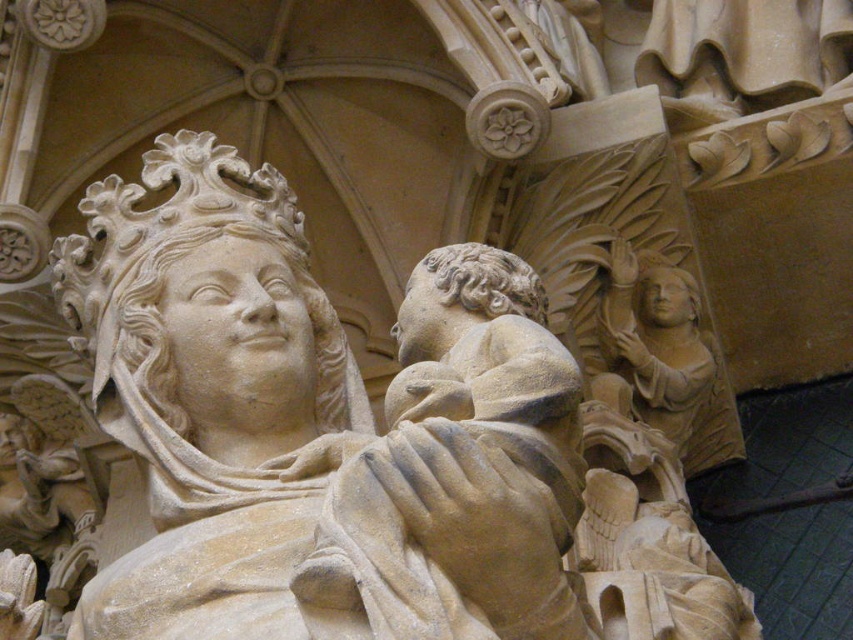
Question: Which of the following is the farthest from the observer?

Choices:
 (A) (648, 259)
 (B) (305, 269)

Answer: (A)

Question: Does stone statue of woman holding child at center have a larger size compared to beige stone angel at right?

Choices:
 (A) no
 (B) yes

Answer: (B)

Question: Is stone statue of woman holding child at center above beige stone angel at right?

Choices:
 (A) no
 (B) yes

Answer: (A)

Question: Among these objects, which one is nearest to the camera?

Choices:
 (A) beige stone angel at right
 (B) stone statue of woman holding child at center

Answer: (B)

Question: Does stone statue of woman holding child at center appear under beige stone angel at right?

Choices:
 (A) no
 (B) yes

Answer: (B)